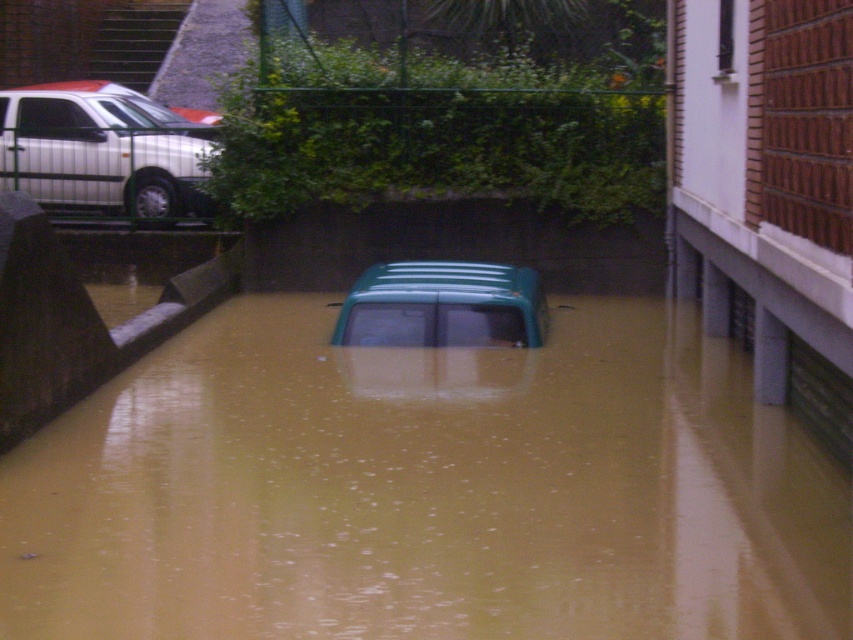
Question: Considering the relative positions of silver metallic van at upper left and green matte van at center in the image provided, where is silver metallic van at upper left located with respect to green matte van at center?

Choices:
 (A) above
 (B) below

Answer: (A)

Question: Is silver metallic van at upper left wider than green matte van at center?

Choices:
 (A) no
 (B) yes

Answer: (B)

Question: Which point is closer to the camera?

Choices:
 (A) (526, 320)
 (B) (68, 122)

Answer: (A)

Question: Among these points, which one is farthest from the camera?

Choices:
 (A) (96, 122)
 (B) (524, 342)

Answer: (A)

Question: Which object is farther from the camera taking this photo?

Choices:
 (A) silver metallic van at upper left
 (B) brown murky water at center
 (C) green matte van at center

Answer: (A)

Question: Can you confirm if brown murky water at center is positioned to the left of green matte van at center?

Choices:
 (A) no
 (B) yes

Answer: (B)